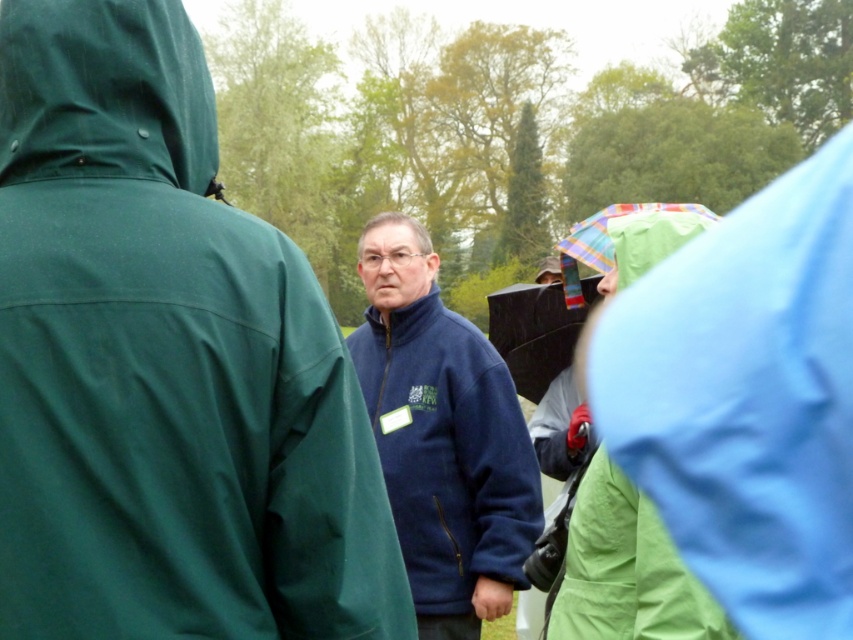
Question: Estimate the real-world distances between objects in this image. Which object is farther from the navy blue fleece at center?

Choices:
 (A) green matte hood at upper left
 (B) navy fleece jacket at center

Answer: (B)

Question: Which object appears farthest from the camera in this image?

Choices:
 (A) green matte hood at upper left
 (B) navy fleece jacket at center
 (C) navy blue fleece at center

Answer: (B)

Question: Is navy blue fleece at center in front of navy fleece jacket at center?

Choices:
 (A) yes
 (B) no

Answer: (A)

Question: Which of the following is the farthest from the observer?

Choices:
 (A) green matte hood at upper left
 (B) navy fleece jacket at center

Answer: (B)

Question: Does navy fleece jacket at center have a lesser width compared to green matte hood at upper left?

Choices:
 (A) yes
 (B) no

Answer: (B)

Question: Is the position of navy blue fleece at center more distant than that of green matte hood at upper left?

Choices:
 (A) no
 (B) yes

Answer: (A)